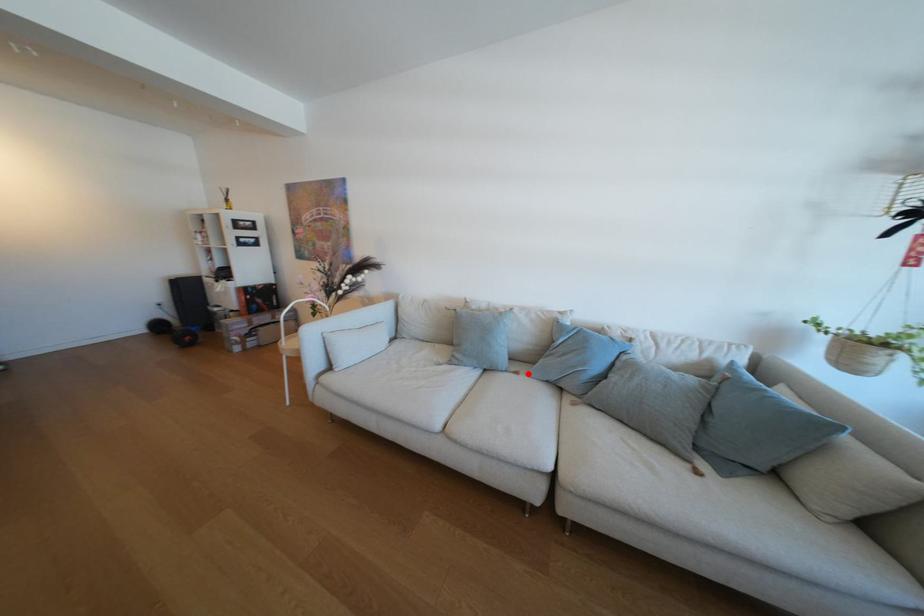
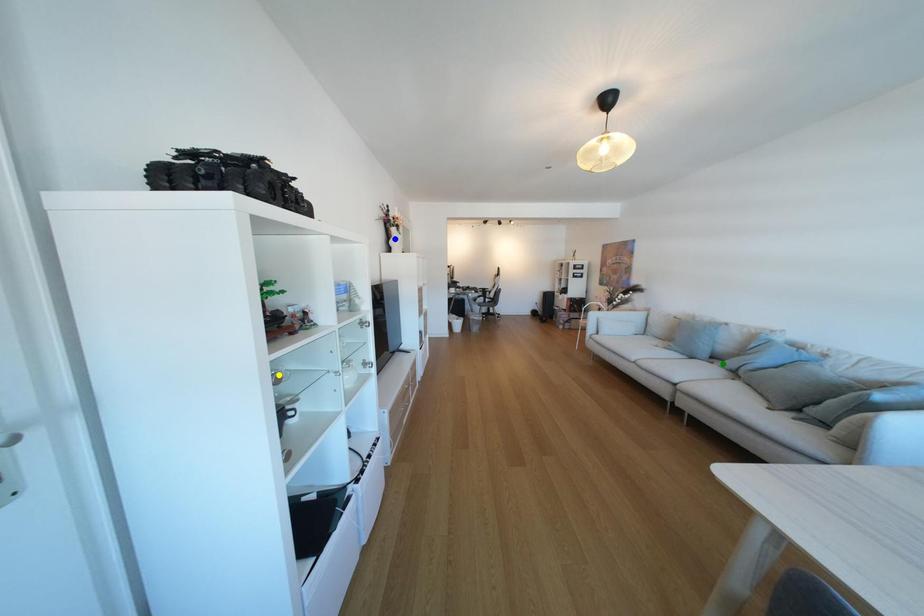
Question: I am providing you with two images of the same scene from different viewpoints. A red point is marked on the first image. You are given multiple points on the second image. Which mark in image 2 goes with the point in image 1?

Choices:
 (A) green point
 (B) blue point
 (C) yellow point

Answer: (A)